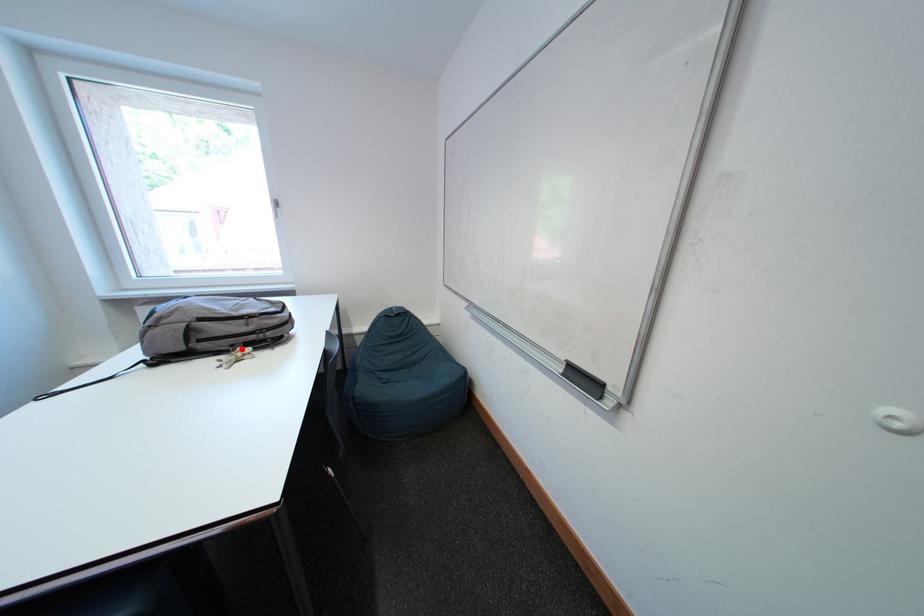
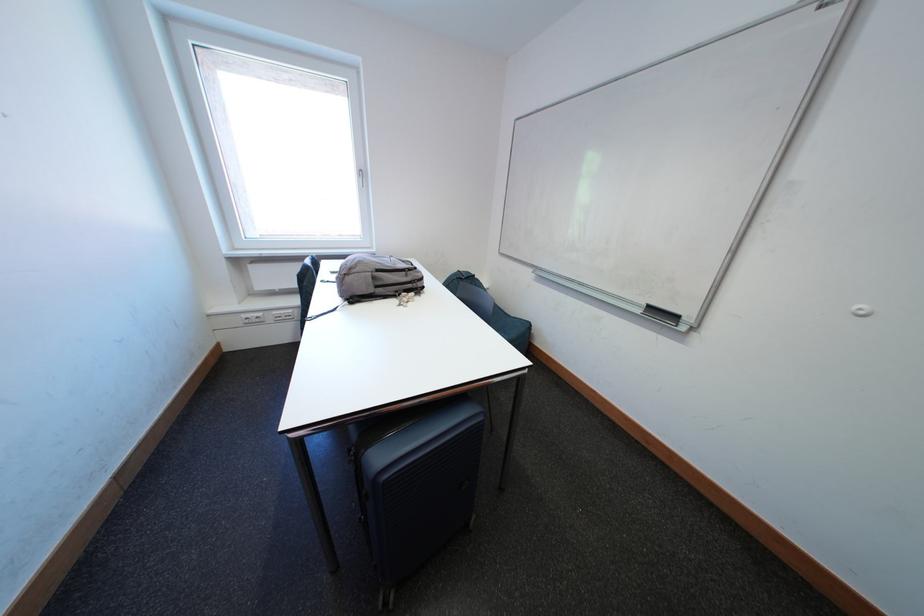
Locate, in the second image, the point that corresponds to the highlighted location in the first image.

(406, 294)